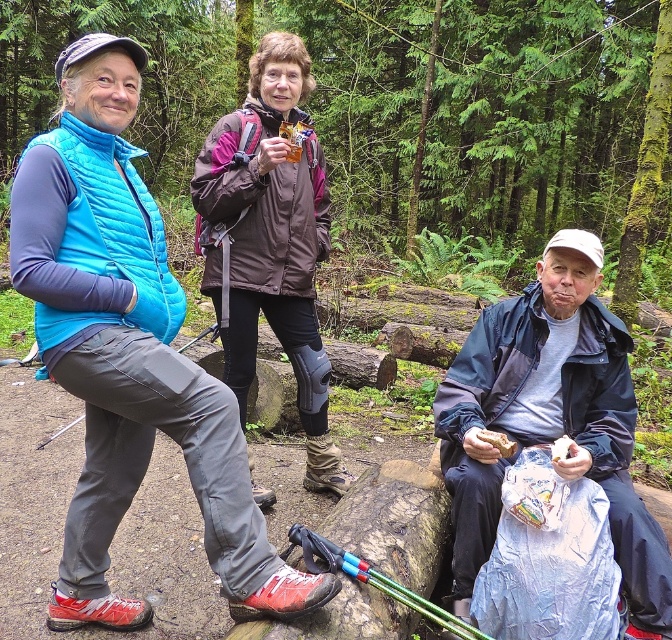
Question: Is matte blue vest at left thinner than dark blue jacket at lower right?

Choices:
 (A) no
 (B) yes

Answer: (A)

Question: Is brown/mesh knee brace at center wider than matte brown sandwich at lower center?

Choices:
 (A) yes
 (B) no

Answer: (A)

Question: Estimate the real-world distances between objects in this image. Which object is closer to the matte blue vest at left?

Choices:
 (A) brown/mesh knee brace at center
 (B) dark blue jacket at lower right

Answer: (A)

Question: Is dark blue jacket at lower right thinner than brown/mesh knee brace at center?

Choices:
 (A) no
 (B) yes

Answer: (A)

Question: Which is farther from the matte brown sandwich at lower center?

Choices:
 (A) brown/mesh knee brace at center
 (B) dark blue jacket at lower right
 (C) matte blue vest at left

Answer: (A)

Question: Among these points, which one is nearest to the camera?

Choices:
 (A) (501, 452)
 (B) (581, 467)
 (C) (110, 426)

Answer: (B)